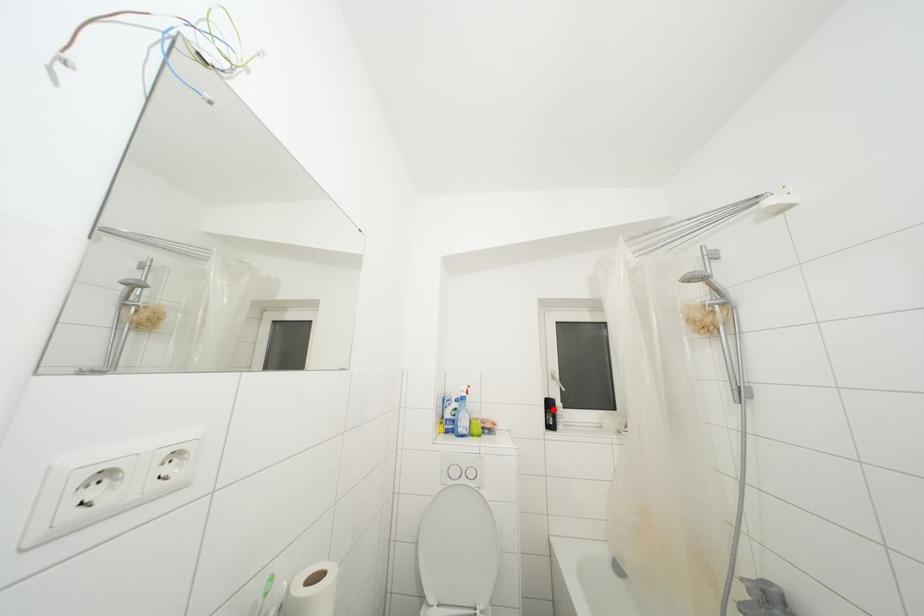
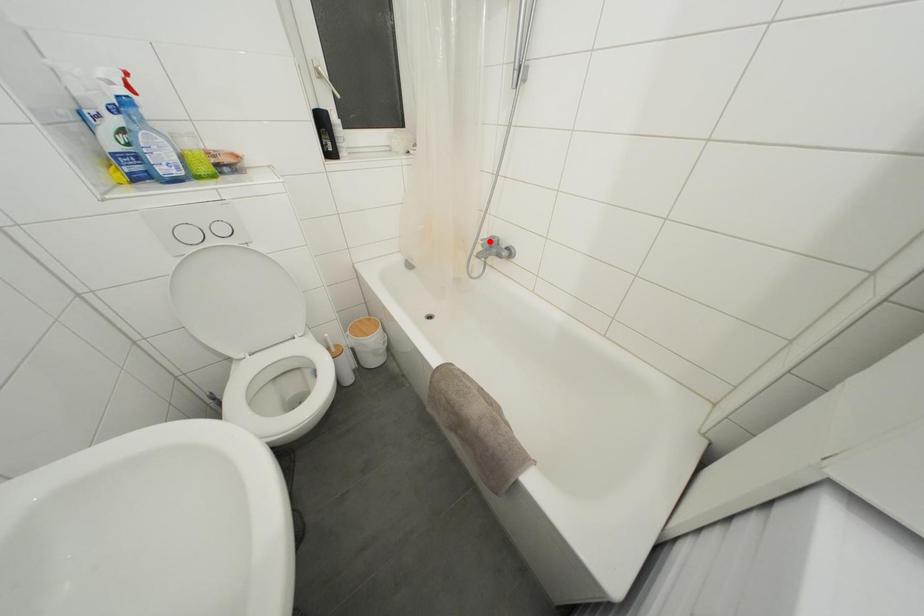
I am providing you with two images of the same scene from different viewpoints. A red point is marked on the first image and another point is marked on the second image. Does the point marked in image1 correspond to the same location as the one in image2?

No